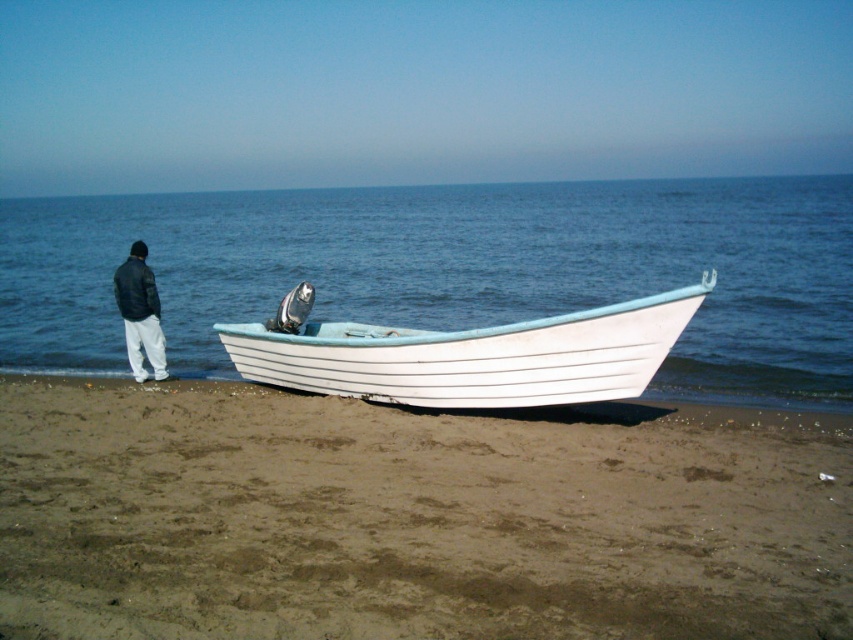
Which is behind, point (277, 224) or point (592, 312)?

The point (277, 224) is behind.

Find the location of a particular element. The height and width of the screenshot is (640, 853). blue water at boat right is located at coordinates click(x=454, y=269).

Locate an element on the screen. blue water at boat right is located at coordinates (454, 269).

Can you confirm if brown sandy beach at lower center is positioned to the right of black leather jacket at left?

Yes, brown sandy beach at lower center is to the right of black leather jacket at left.

Does brown sandy beach at lower center appear over black leather jacket at left?

No.

Does point (718, 595) come behind point (128, 321)?

No, (718, 595) is in front of (128, 321).

The image size is (853, 640). I want to click on brown sandy beach at lower center, so click(x=413, y=516).

Who is more distant from viewer, [781,528] or [341,292]?

Point [341,292]

Can you confirm if brown sandy beach at lower center is bigger than blue water at boat right?

No, brown sandy beach at lower center is not bigger than blue water at boat right.

Between point (850, 611) and point (103, 353), which one is positioned in front?

Point (850, 611) is in front.

Find the location of a particular element. Image resolution: width=853 pixels, height=640 pixels. brown sandy beach at lower center is located at coordinates (413, 516).